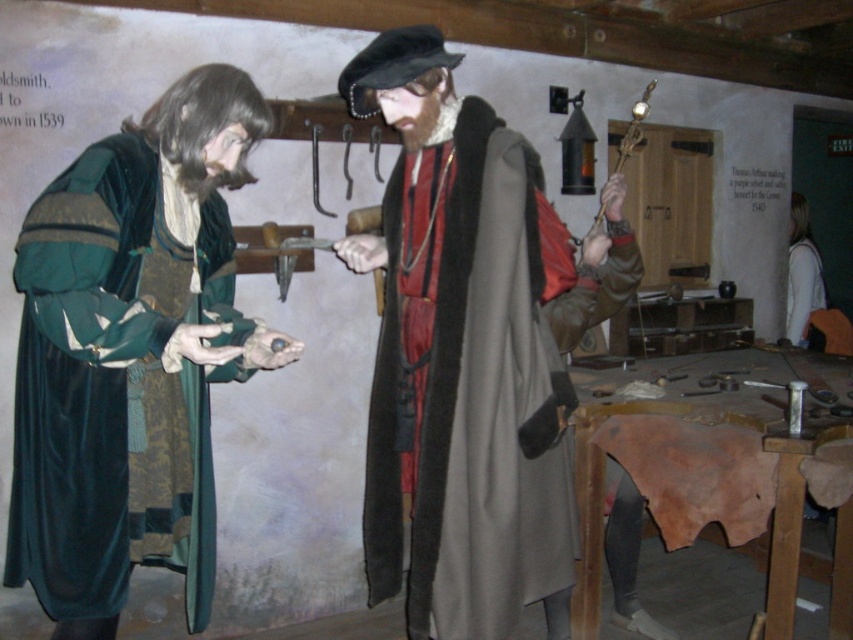
You are a costume designer observing the medieval workshop scene. You need to determine which costume has a larger width for a stage performance. The velvet green robe at left and the dark gray woolen cloak at center are both candidates. Based on the scene, which one is wider?

The velvet green robe at left is wider than the dark gray woolen cloak at center according to the description, so the velvet green robe at left would be the better choice for a wider costume in the stage performance.

From the picture: You are a visitor at the medieval workshop and want to know which clothing item is taller between the velvet green robe at left and the dark gray woolen cloak at center. Can you tell me which one is taller?

The velvet green robe at left is much taller than the dark gray woolen cloak at center.

In the scene shown: You are standing in the medieval workshop scene. You need to locate the velvet green robe at left. Where exactly is it positioned in the image?

The velvet green robe at left is located at point [131,355].